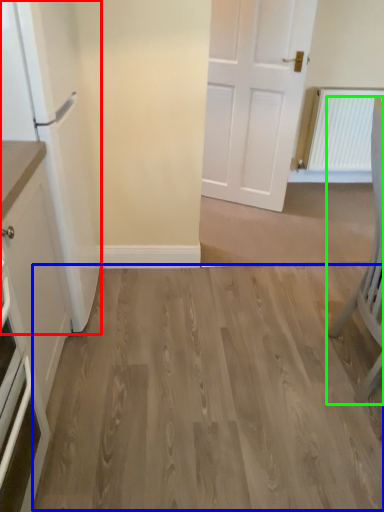
Question: Which object is the closest to the fridge (highlighted by a red box)? Choose among these: hardwood (highlighted by a blue box) or chair (highlighted by a green box).

Choices:
 (A) hardwood
 (B) chair

Answer: (A)